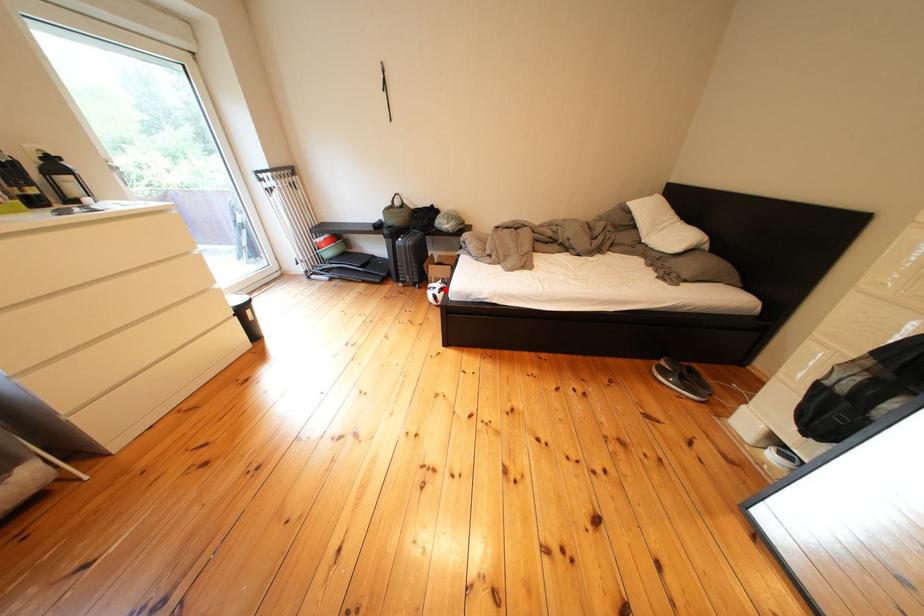
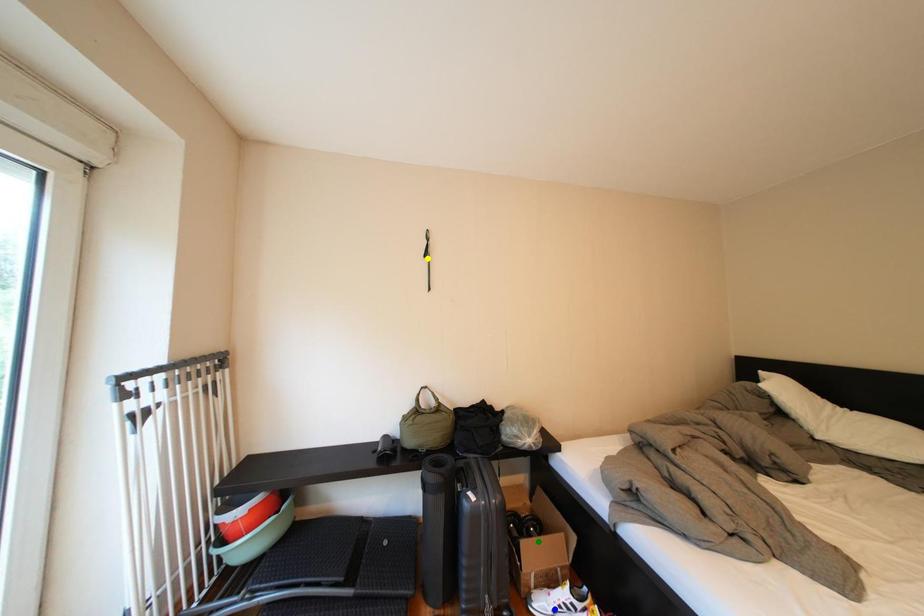
Question: I am providing you with two images of the same scene from different viewpoints. A red point is marked on the first image. You are given multiple points on the second image. In image 2, which mark is for the same physical point as the one in image 1?

Choices:
 (A) yellow point
 (B) blue point
 (C) green point

Answer: (B)